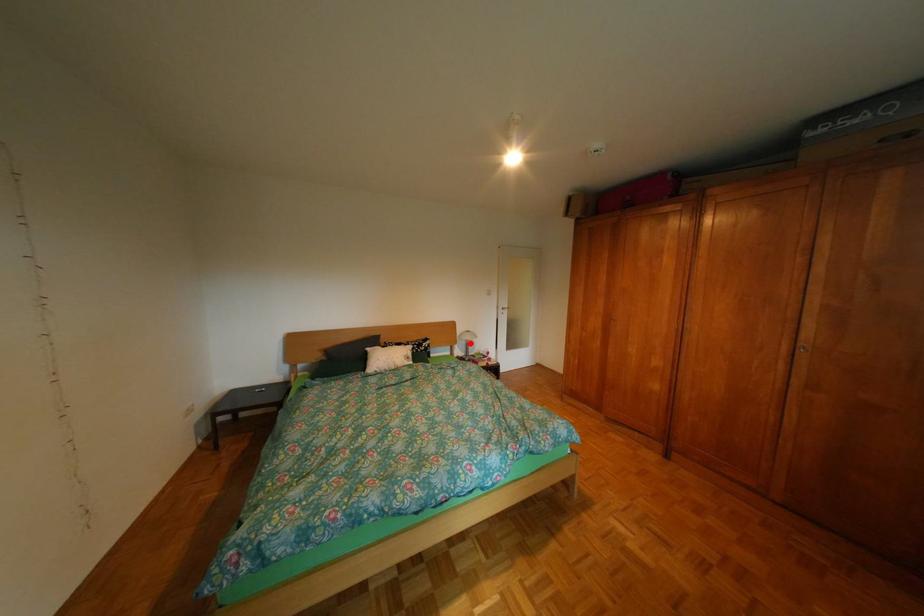
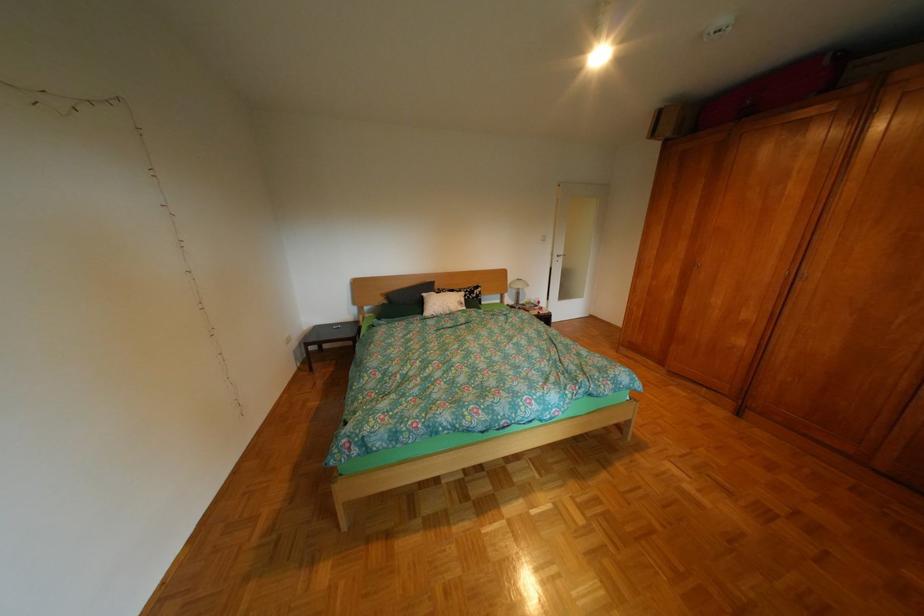
Find the pixel in the second image that matches the highlighted location in the first image.

(521, 292)